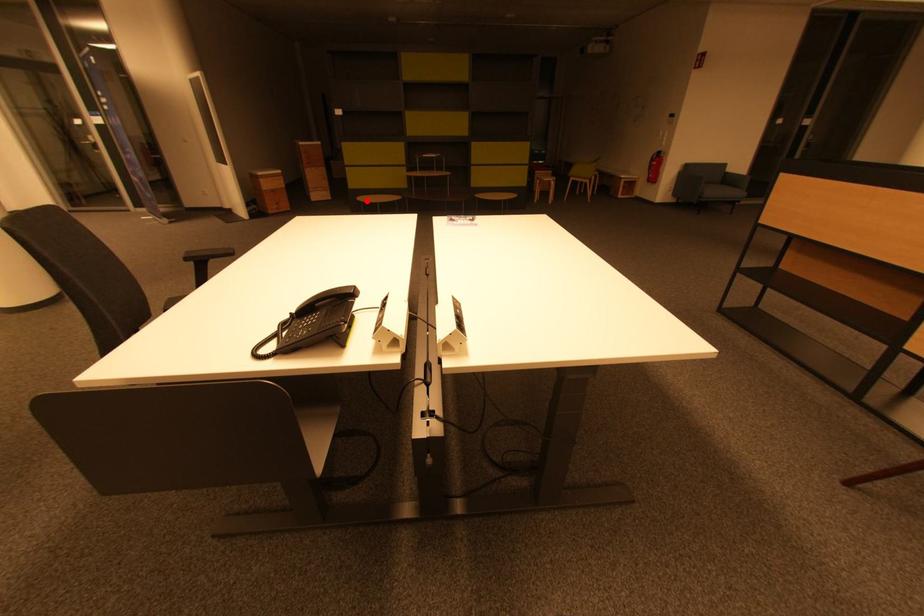
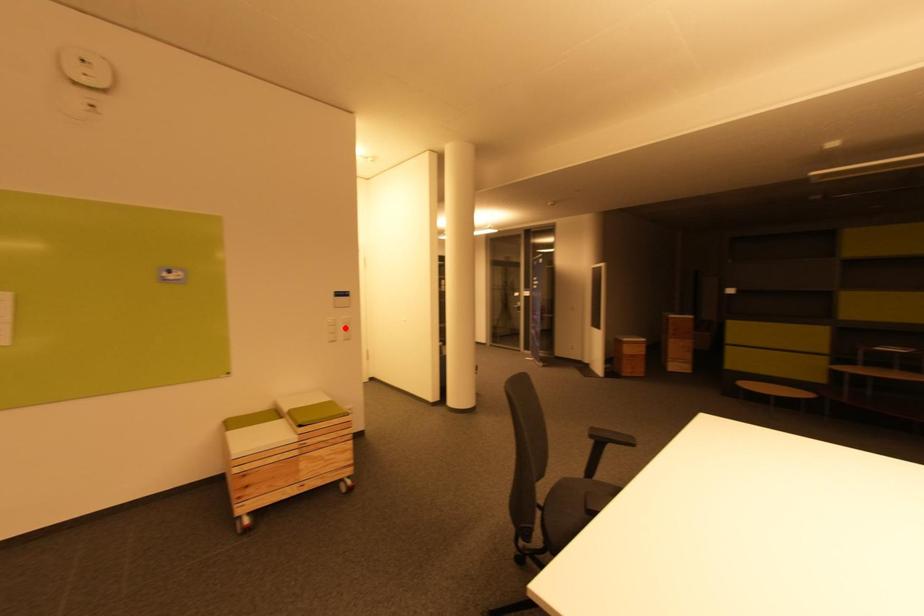
I am providing you with two images of the same scene from different viewpoints. A red point is marked on the first image and another point is marked on the second image. Is the red point in image1 aligned with the point shown in image2?

No